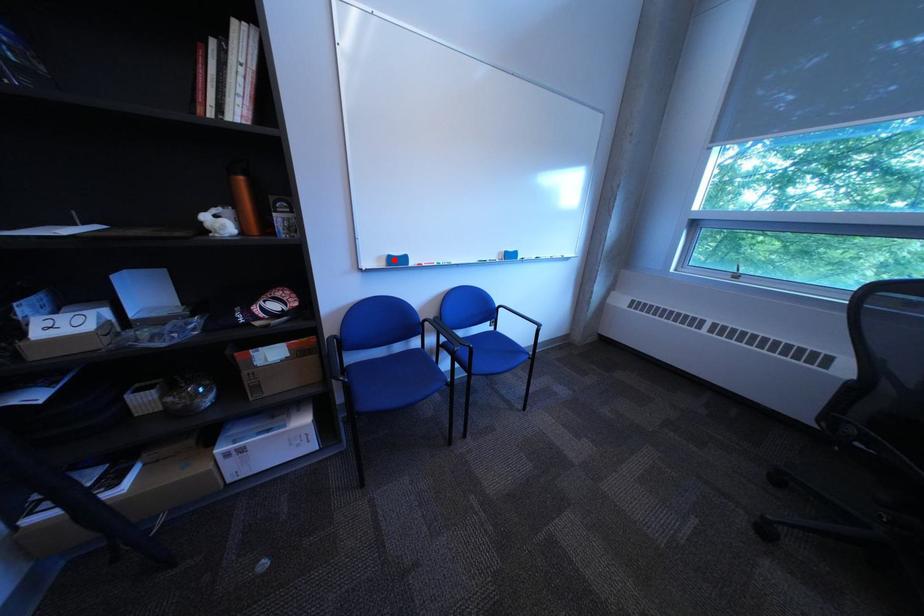
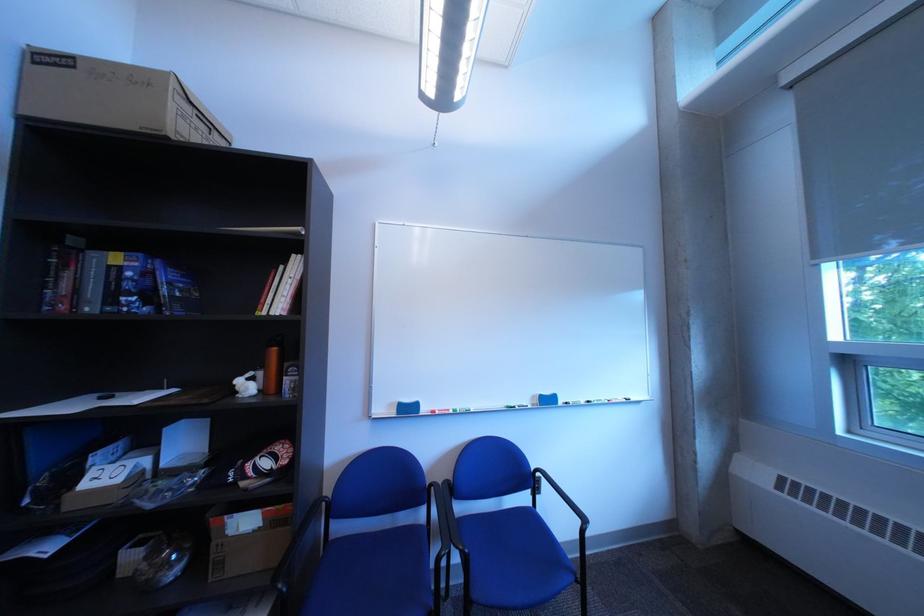
The point at the highlighted location is marked in the first image. Where is the corresponding point in the second image?

(406, 407)